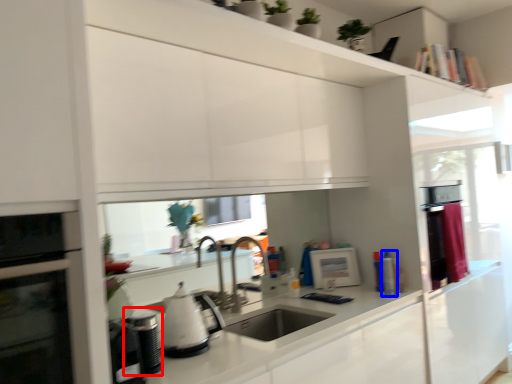
Question: Which object is closer to the camera taking this photo, appliance (highlighted by a red box) or appliance (highlighted by a blue box)?

Choices:
 (A) appliance
 (B) appliance

Answer: (A)